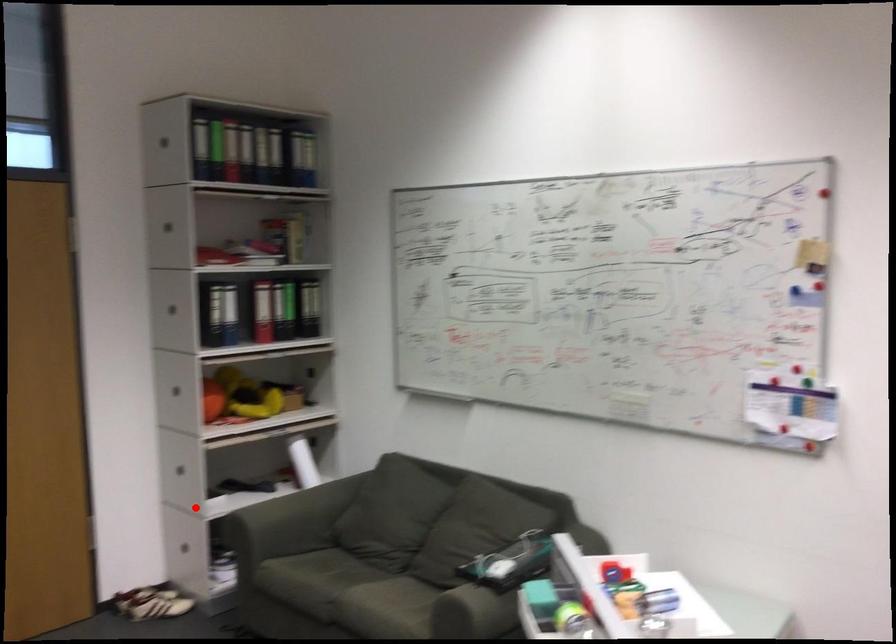
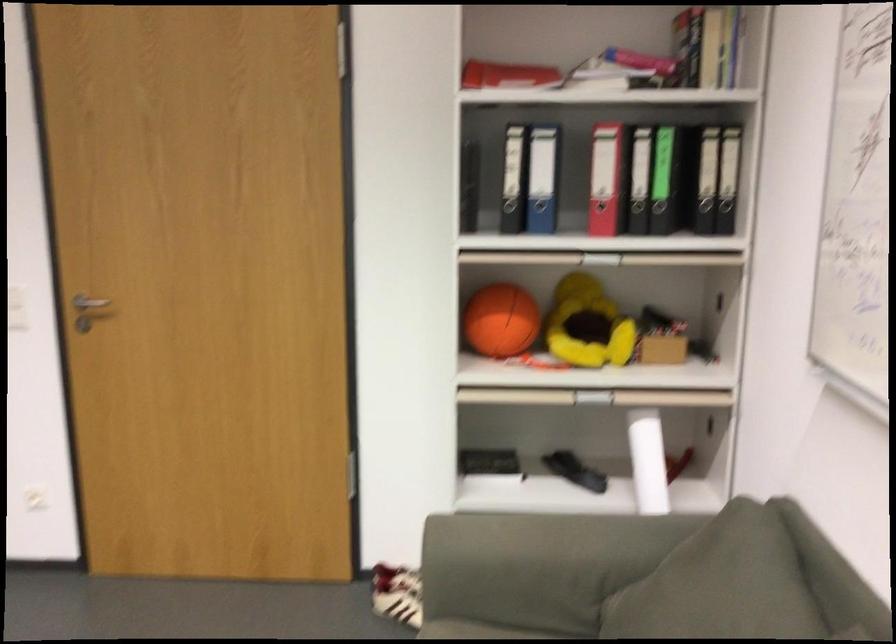
The point at the highlighted location is marked in the first image. Where is the corresponding point in the second image?

(489, 464)